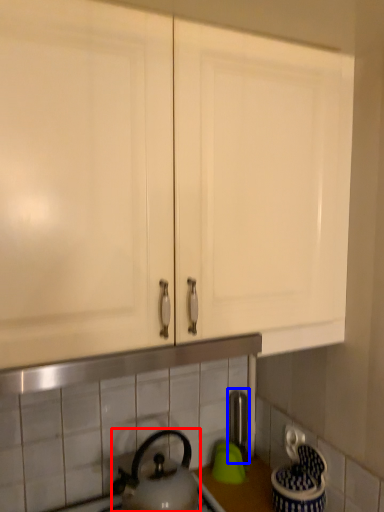
Question: Which point is further to the camera, kettle (highlighted by a red box) or faucet (highlighted by a blue box)?

Choices:
 (A) kettle
 (B) faucet

Answer: (B)